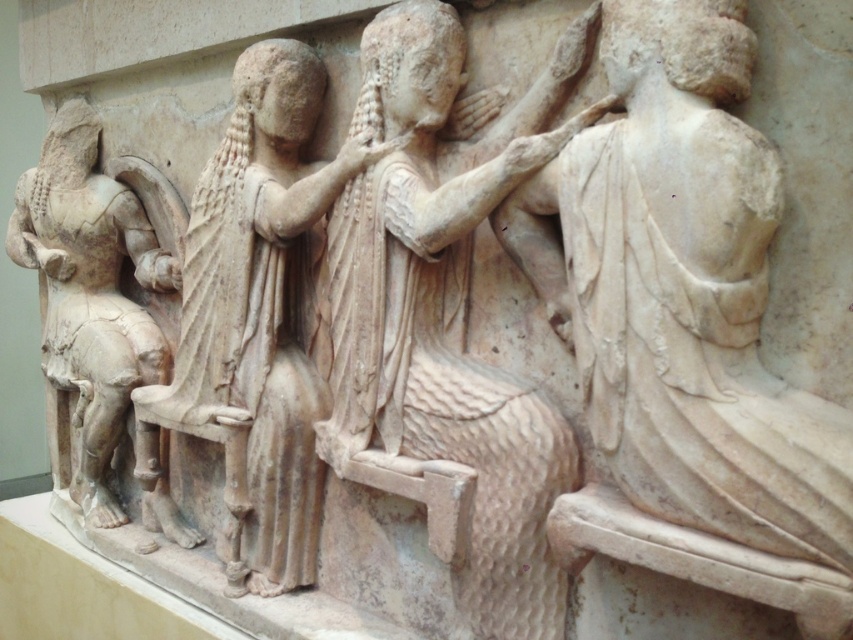
Question: Is white marble draped cloth at right bigger than white marble figure at left?

Choices:
 (A) yes
 (B) no

Answer: (B)

Question: Considering the real-world distances, which object is farthest from the white marble figure at left?

Choices:
 (A) white marble draped cloth at right
 (B) matte stone figure at center
 (C) smooth beige statue at center

Answer: (A)

Question: Which point is closer to the camera?

Choices:
 (A) (142, 513)
 (B) (448, 116)
 (C) (210, 186)

Answer: (B)

Question: Among these points, which one is nearest to the camera?

Choices:
 (A) (529, 627)
 (B) (213, 218)

Answer: (A)

Question: Can you confirm if white marble draped cloth at right is bigger than matte stone figure at center?

Choices:
 (A) yes
 (B) no

Answer: (B)

Question: Observing the image, what is the correct spatial positioning of white marble draped cloth at right in reference to white marble figure at left?

Choices:
 (A) above
 (B) below

Answer: (B)